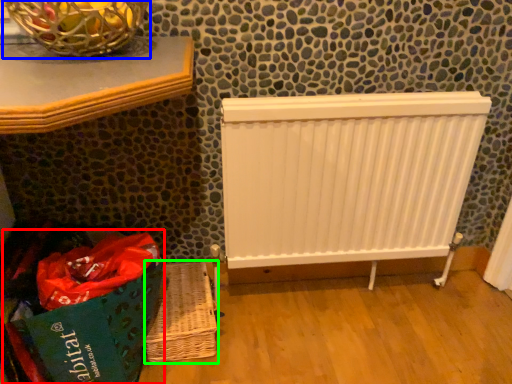
Question: Based on their relative distances, which object is farther from shopping bag (highlighted by a red box)? Choose from basket container (highlighted by a blue box) and basket (highlighted by a green box).

Choices:
 (A) basket container
 (B) basket

Answer: (A)